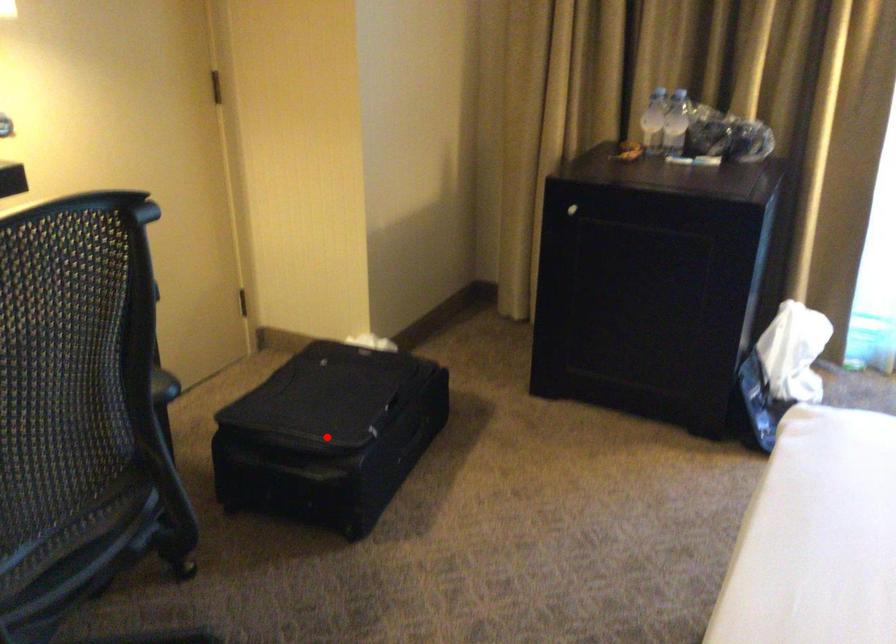
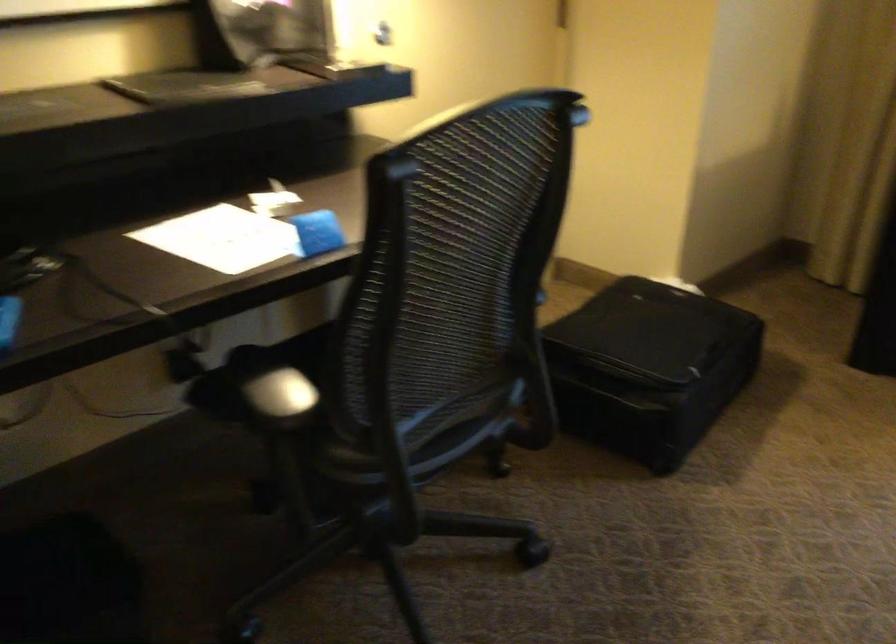
Where in the second image is the point corresponding to the highlighted location from the first image?

(649, 366)